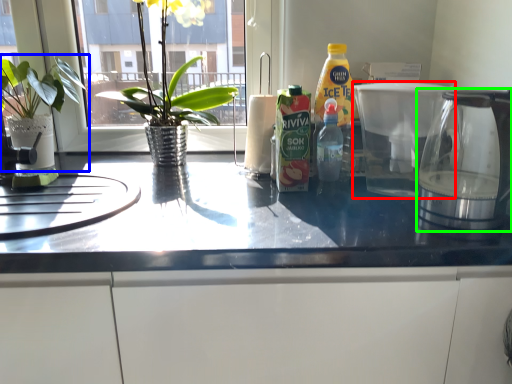
Question: Based on their relative distances, which object is nearer to coffeepot (highlighted by a red box)? Choose from houseplant (highlighted by a blue box) and coffeepot (highlighted by a green box).

Choices:
 (A) houseplant
 (B) coffeepot

Answer: (B)